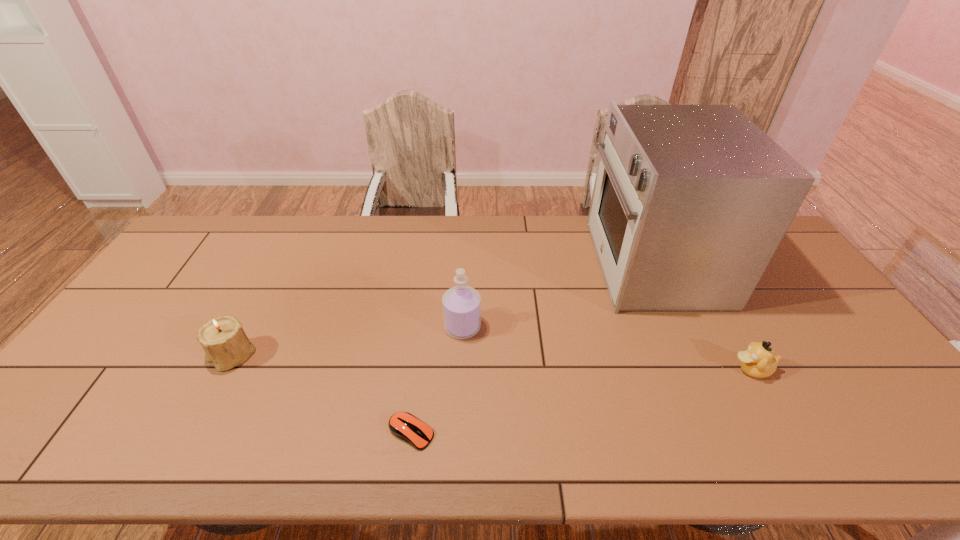
This screenshot has width=960, height=540. Identify the location of free space located on the front panel of the toaster oven. (537, 264).

Locate an element on the screen. This screenshot has width=960, height=540. vacant space located on the left of the fourth shortest object is located at coordinates (310, 327).

Locate an element on the screen. This screenshot has width=960, height=540. free space located on the right of the third tallest object is located at coordinates (396, 355).

At what (x,y) coordinates should I click in order to perform the action: click on vacant space located 0.180m on the face of the duckling. Please return your answer as a coordinate pair (x, y). This screenshot has width=960, height=540. Looking at the image, I should click on (661, 369).

Locate an element on the screen. The width and height of the screenshot is (960, 540). free spot located on the face of the duckling is located at coordinates (638, 369).

At what (x,y) coordinates should I click in order to perform the action: click on free point located on the face of the duckling. Please return your answer as a coordinate pair (x, y). This screenshot has height=540, width=960. Looking at the image, I should click on (677, 369).

Find the location of a particular element. This screenshot has width=960, height=540. free space located on the back of the second object from left to right is located at coordinates (427, 301).

Locate an element on the screen. object that is at the far edge is located at coordinates (690, 202).

This screenshot has height=540, width=960. I want to click on object that is at the near edge, so click(404, 425).

In the image, there is a desktop. Find the location of `free space at the far edge`. free space at the far edge is located at coordinates (472, 218).